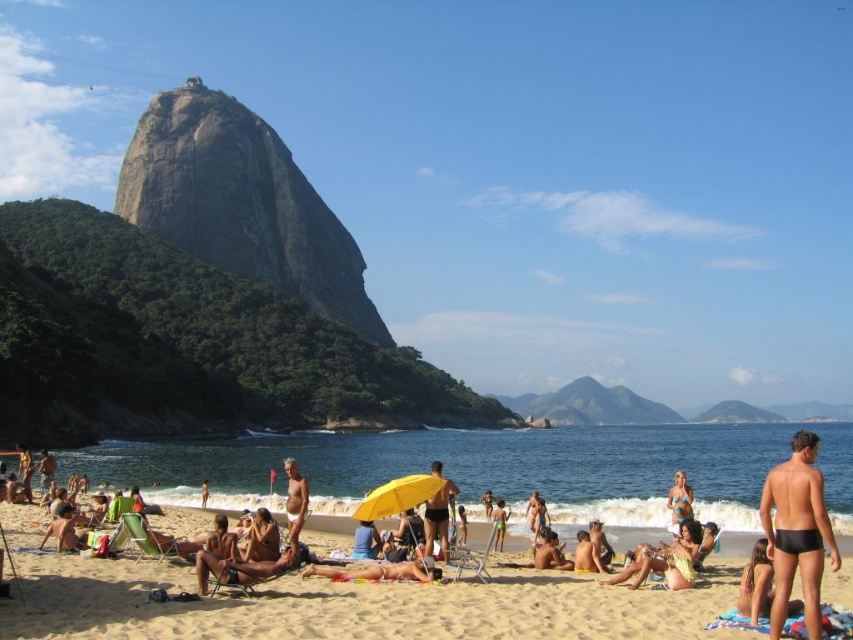
Question: Is black matte swimsuit at right to the left of yellow matte umbrella at center from the viewer's perspective?

Choices:
 (A) no
 (B) yes

Answer: (A)

Question: Considering the real-world distances, which object is closest to the yellow matte umbrella at center?

Choices:
 (A) tan skin person at center
 (B) matte yellow umbrella at center
 (C) green swimwear at center
 (D) white sandy beach at lower center

Answer: (B)

Question: Where is tan skin human at center located in relation to tan skin person at lower left in the image?

Choices:
 (A) left
 (B) right

Answer: (B)

Question: Based on their relative distances, which object is nearer to the black matte swimsuit at right?

Choices:
 (A) smooth tan skin at center
 (B) green swimwear at center

Answer: (B)

Question: Does white sandy beach at lower center appear on the left side of black granite rock at upper left?

Choices:
 (A) no
 (B) yes

Answer: (A)

Question: Which point is farther to the camera?

Choices:
 (A) black matte swimsuit at right
 (B) tan skin person at lower left
 (C) smooth tan skin at center
 (D) white sandy beach at lower center

Answer: (B)